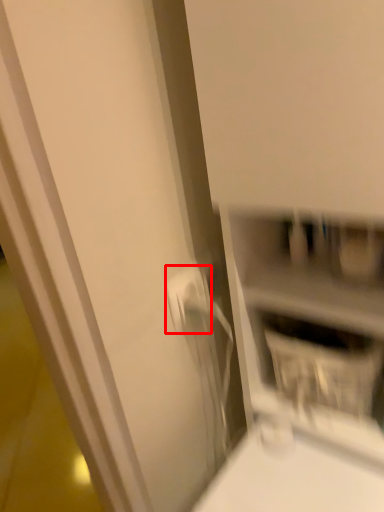
Question: From the image's perspective, what is the correct spatial positioning of electric outlet (annotated by the red box) in reference to shelf?

Choices:
 (A) above
 (B) below

Answer: (A)